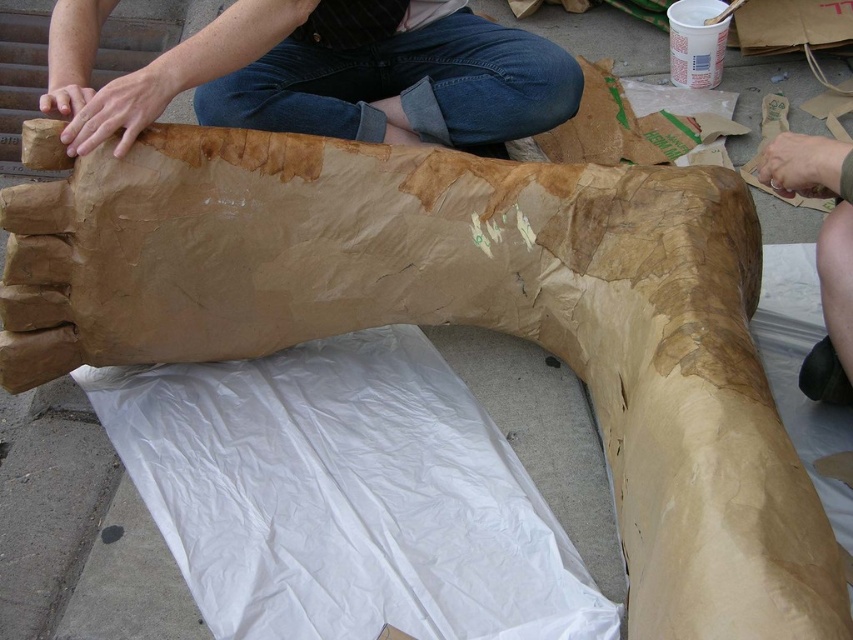
Is brown paper at upper center positioned at the back of skinny brown paper at right?

Yes.

Who is more forward, (332, 100) or (798, 134)?

Point (798, 134)

Where is `brown paper at upper center`? The width and height of the screenshot is (853, 640). brown paper at upper center is located at coordinates (311, 76).